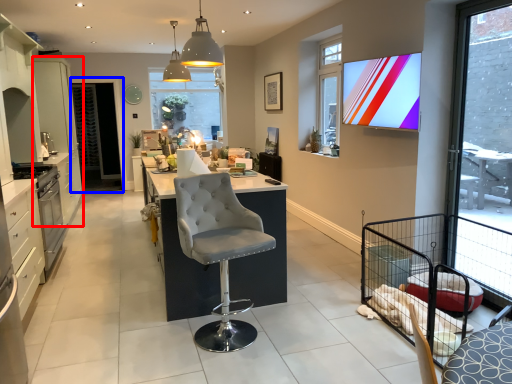
Question: Which of the following is the farthest to the observer, cabinetry (highlighted by a red box) or screen door (highlighted by a blue box)?

Choices:
 (A) cabinetry
 (B) screen door

Answer: (B)